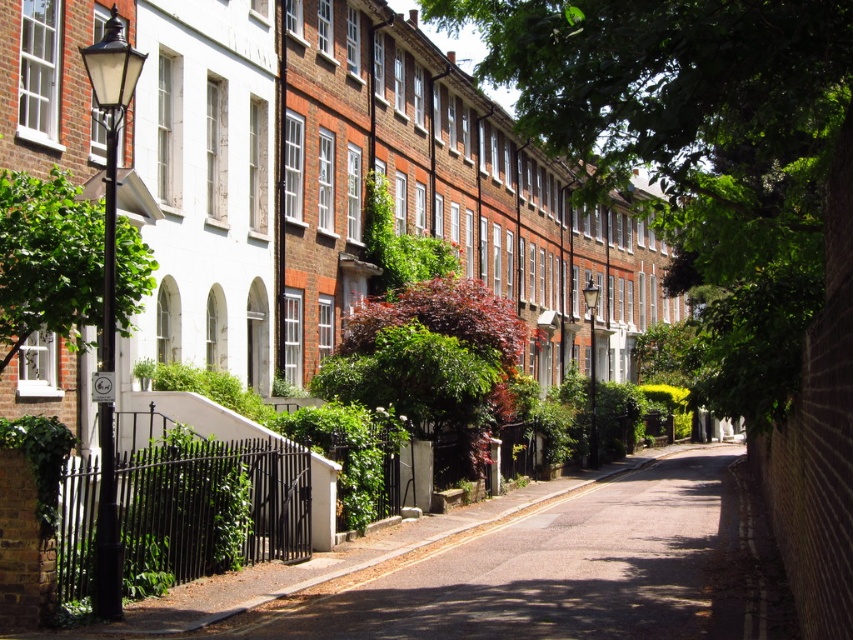
Question: Among these objects, which one is farthest from the camera?

Choices:
 (A) green leafy tree at left
 (B) smooth asphalt road at center
 (C) green leafy tree at center

Answer: (A)

Question: Can you confirm if green leafy tree at center is positioned above green leafy tree at left?

Choices:
 (A) yes
 (B) no

Answer: (A)

Question: Does smooth asphalt road at center have a lesser width compared to green leafy tree at left?

Choices:
 (A) yes
 (B) no

Answer: (B)

Question: Can you confirm if green leafy tree at center is thinner than smooth asphalt road at center?

Choices:
 (A) no
 (B) yes

Answer: (A)

Question: Which of the following is the closest to the observer?

Choices:
 (A) (68, 300)
 (B) (437, 10)
 (C) (612, 614)

Answer: (C)

Question: Which is nearer to the green leafy tree at center?

Choices:
 (A) green leafy tree at left
 (B) smooth asphalt road at center

Answer: (B)